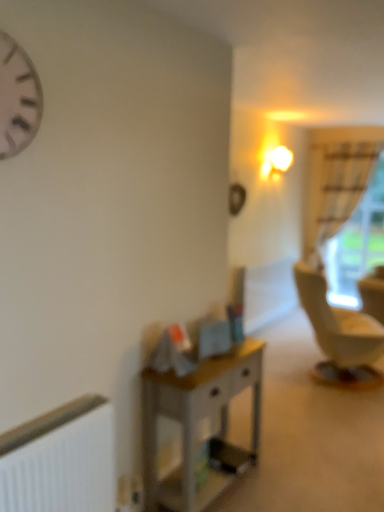
Question: Does white sheer curtain at right have a greater width compared to white matte clock at upper left?

Choices:
 (A) no
 (B) yes

Answer: (B)

Question: Is white matte clock at upper left at the back of white sheer curtain at right?

Choices:
 (A) yes
 (B) no

Answer: (B)

Question: Can you confirm if white sheer curtain at right is positioned to the left of white matte clock at upper left?

Choices:
 (A) yes
 (B) no

Answer: (B)

Question: Are white sheer curtain at right and white matte clock at upper left making contact?

Choices:
 (A) yes
 (B) no

Answer: (B)

Question: From a real-world perspective, is white sheer curtain at right positioned under white matte clock at upper left based on gravity?

Choices:
 (A) no
 (B) yes

Answer: (B)

Question: Considering the positions of white matte radiator at lower left and white sheer curtain at right in the image, is white matte radiator at lower left taller or shorter than white sheer curtain at right?

Choices:
 (A) tall
 (B) short

Answer: (B)

Question: From a real-world perspective, is white matte radiator at lower left above or below white sheer curtain at right?

Choices:
 (A) below
 (B) above

Answer: (A)

Question: Is white matte radiator at lower left wider or thinner than white sheer curtain at right?

Choices:
 (A) wide
 (B) thin

Answer: (B)

Question: From the image's perspective, relative to white sheer curtain at right, is white matte radiator at lower left above or below?

Choices:
 (A) below
 (B) above

Answer: (A)

Question: Is white matte clock at upper left taller or shorter than white sheer curtain at right?

Choices:
 (A) short
 (B) tall

Answer: (A)

Question: Would you say white matte clock at upper left is inside or outside white sheer curtain at right?

Choices:
 (A) inside
 (B) outside

Answer: (B)

Question: From the image's perspective, is white matte clock at upper left located above or below white sheer curtain at right?

Choices:
 (A) below
 (B) above

Answer: (B)

Question: From a real-world perspective, is white matte clock at upper left physically located above or below white sheer curtain at right?

Choices:
 (A) above
 (B) below

Answer: (A)

Question: From the image's perspective, is wooden desk at center located above or below white sheer curtain at right?

Choices:
 (A) below
 (B) above

Answer: (A)

Question: In terms of width, does wooden desk at center look wider or thinner when compared to white sheer curtain at right?

Choices:
 (A) wide
 (B) thin

Answer: (B)